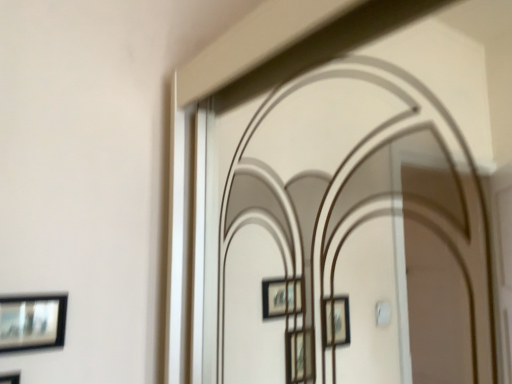
Question: Is matte black picture frame at lower left, placed as the 1th picture frame when sorted from top to bottom, completely or partially outside of matte black picture frame at lower left, which is the first picture frame in bottom-to-top order?

Choices:
 (A) no
 (B) yes

Answer: (B)

Question: Is the depth of matte black picture frame at lower left, the 2th picture frame in the bottom-to-top sequence, less than that of matte black picture frame at lower left, which is the first picture frame in bottom-to-top order?

Choices:
 (A) no
 (B) yes

Answer: (A)

Question: Does matte black picture frame at lower left, placed as the 1th picture frame when sorted from top to bottom, have a greater height compared to matte black picture frame at lower left, which is the first picture frame in bottom-to-top order?

Choices:
 (A) yes
 (B) no

Answer: (B)

Question: From a real-world perspective, is matte black picture frame at lower left, the 2th picture frame in the bottom-to-top sequence, on matte black picture frame at lower left, which appears as the 2th picture frame when viewed from the top?

Choices:
 (A) no
 (B) yes

Answer: (B)

Question: Would you say matte black picture frame at lower left, which is the first picture frame in bottom-to-top order, is part of matte black picture frame at lower left, the 2th picture frame in the bottom-to-top sequence,'s contents?

Choices:
 (A) no
 (B) yes

Answer: (A)

Question: Considering the relative sizes of matte black picture frame at lower left, the 2th picture frame in the bottom-to-top sequence, and matte black picture frame at lower left, which is the first picture frame in bottom-to-top order, in the image provided, is matte black picture frame at lower left, the 2th picture frame in the bottom-to-top sequence, smaller than matte black picture frame at lower left, which is the first picture frame in bottom-to-top order,?

Choices:
 (A) no
 (B) yes

Answer: (B)

Question: From a real-world perspective, is matte black picture frame at lower left, which is the first picture frame in bottom-to-top order, on matte black picture frame at lower left, placed as the 1th picture frame when sorted from top to bottom?

Choices:
 (A) no
 (B) yes

Answer: (A)

Question: Could matte black picture frame at lower left, placed as the 1th picture frame when sorted from top to bottom, be considered to be inside matte black picture frame at lower left, which appears as the 2th picture frame when viewed from the top?

Choices:
 (A) no
 (B) yes

Answer: (A)

Question: Does matte black picture frame at lower left, which is the first picture frame in bottom-to-top order, have a greater width compared to matte black picture frame at lower left, the 2th picture frame in the bottom-to-top sequence?

Choices:
 (A) no
 (B) yes

Answer: (B)

Question: Can you confirm if matte black picture frame at lower left, which is the first picture frame in bottom-to-top order, is smaller than matte black picture frame at lower left, placed as the 1th picture frame when sorted from top to bottom?

Choices:
 (A) no
 (B) yes

Answer: (A)

Question: Is matte black picture frame at lower left, which appears as the 2th picture frame when viewed from the top, oriented away from matte black picture frame at lower left, the 2th picture frame in the bottom-to-top sequence?

Choices:
 (A) yes
 (B) no

Answer: (B)

Question: Considering the relative sizes of matte black picture frame at lower left, which is the first picture frame in bottom-to-top order, and matte black picture frame at lower left, the 2th picture frame in the bottom-to-top sequence, in the image provided, is matte black picture frame at lower left, which is the first picture frame in bottom-to-top order, shorter than matte black picture frame at lower left, the 2th picture frame in the bottom-to-top sequence,?

Choices:
 (A) yes
 (B) no

Answer: (B)

Question: In terms of height, does matte black picture frame at lower left, which appears as the 2th picture frame when viewed from the top, look taller or shorter compared to matte black picture frame at lower left, placed as the 1th picture frame when sorted from top to bottom?

Choices:
 (A) short
 (B) tall

Answer: (B)